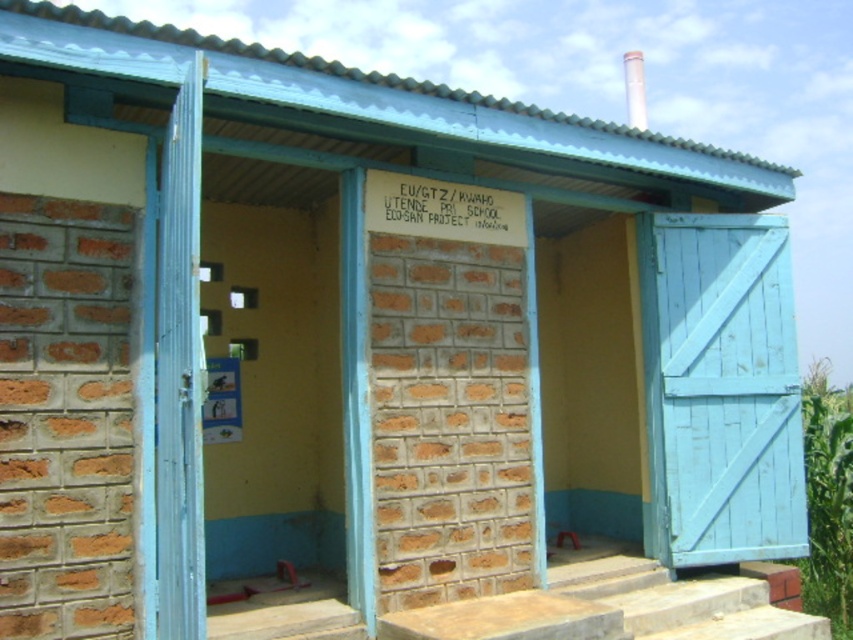
Question: Where is light blue wooden door at center located in relation to green leafy corn at right in the image?

Choices:
 (A) above
 (B) below

Answer: (A)

Question: Which of the following is the closest to the observer?

Choices:
 (A) light blue wooden door at center
 (B) green leafy corn at right

Answer: (A)

Question: Which of the following is the closest to the observer?

Choices:
 (A) (764, 509)
 (B) (601, 573)
 (C) (161, 352)

Answer: (C)

Question: Where is blue painted wood door at left located in relation to green leafy corn at right in the image?

Choices:
 (A) above
 (B) below

Answer: (A)

Question: Observing the image, what is the correct spatial positioning of concrete steps at center in reference to green leafy corn at right?

Choices:
 (A) above
 (B) below

Answer: (A)

Question: Which of the following is the farthest from the observer?

Choices:
 (A) blue painted wood door at left
 (B) concrete steps at center
 (C) green leafy corn at right
 (D) light blue wooden door at center

Answer: (C)